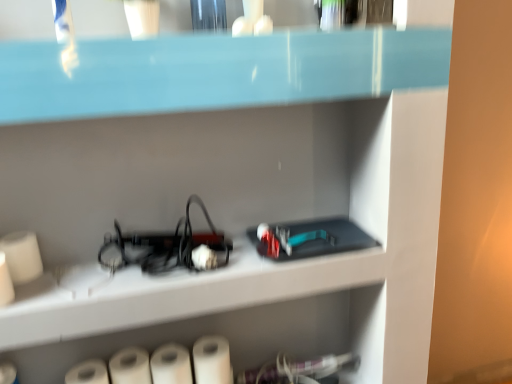
Question: Is there a large distance between white matte paper towel at lower left, the fourth paper towel positioned from the right, and white matte paper towel at lower center, acting as the 3th paper towel starting from the left?

Choices:
 (A) no
 (B) yes

Answer: (A)

Question: Considering the relative sizes of white matte paper towel at lower left, which is the 1th paper towel in left-to-right order, and white matte paper towel at lower center, acting as the 3th paper towel starting from the left, in the image provided, is white matte paper towel at lower left, which is the 1th paper towel in left-to-right order, bigger than white matte paper towel at lower center, acting as the 3th paper towel starting from the left,?

Choices:
 (A) yes
 (B) no

Answer: (A)

Question: Can you confirm if white matte paper towel at lower left, which is the 1th paper towel in left-to-right order, is taller than white matte paper towel at lower center, acting as the 3th paper towel starting from the left?

Choices:
 (A) no
 (B) yes

Answer: (A)

Question: Is white matte paper towel at lower left, the fourth paper towel positioned from the right, shorter than white matte paper towel at lower center, the 2th paper towel positioned from the right?

Choices:
 (A) yes
 (B) no

Answer: (A)

Question: Is white matte paper towel at lower center, acting as the 3th paper towel starting from the left, inside white matte paper towel at lower left, which is the 1th paper towel in left-to-right order?

Choices:
 (A) no
 (B) yes

Answer: (A)

Question: Does white matte paper towel at lower left, which is the 1th paper towel in left-to-right order, appear on the left side of white matte paper towel at lower center, acting as the 3th paper towel starting from the left?

Choices:
 (A) no
 (B) yes

Answer: (B)

Question: Does white matte paper towel at lower center, acting as the 3th paper towel starting from the left, lie in front of white matte paper towel at lower center, which is the 1th paper towel in right-to-left order?

Choices:
 (A) yes
 (B) no

Answer: (A)

Question: Is white matte paper towel at lower center, the 2th paper towel positioned from the right, not inside white matte paper towel at lower center, marked as the 4th paper towel in a left-to-right arrangement?

Choices:
 (A) yes
 (B) no

Answer: (A)

Question: Is white matte paper towel at lower center, acting as the 3th paper towel starting from the left, thinner than white matte paper towel at lower center, which is the 1th paper towel in right-to-left order?

Choices:
 (A) yes
 (B) no

Answer: (B)

Question: Does white matte paper towel at lower center, the 2th paper towel positioned from the right, have a lesser height compared to white matte paper towel at lower center, marked as the 4th paper towel in a left-to-right arrangement?

Choices:
 (A) yes
 (B) no

Answer: (A)

Question: Can you confirm if white matte paper towel at lower center, the 2th paper towel positioned from the right, is taller than white matte paper towel at lower center, marked as the 4th paper towel in a left-to-right arrangement?

Choices:
 (A) no
 (B) yes

Answer: (A)

Question: Is white matte paper towel at lower center, the 2th paper towel positioned from the right, far from white matte paper towel at lower center, marked as the 4th paper towel in a left-to-right arrangement?

Choices:
 (A) yes
 (B) no

Answer: (B)

Question: Does white matte paper towel at lower left, the fourth paper towel positioned from the right, have a lesser width compared to white matte paper towel at lower center, which is the 1th paper towel in right-to-left order?

Choices:
 (A) no
 (B) yes

Answer: (A)